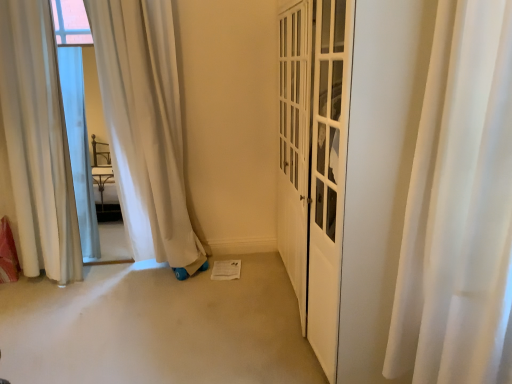
The width and height of the screenshot is (512, 384). Find the location of `vacant area that is in front of white sheer curtain at left, acting as the 1th curtain starting from the left`. vacant area that is in front of white sheer curtain at left, acting as the 1th curtain starting from the left is located at coordinates (32, 311).